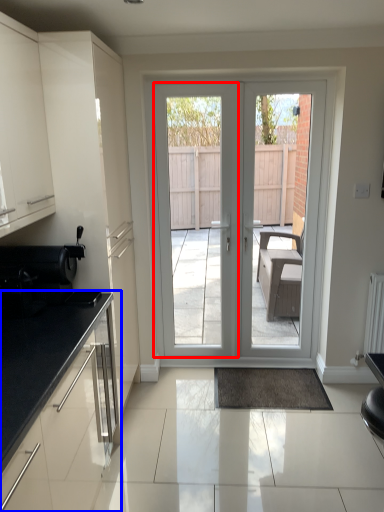
Question: Which object is further to the camera taking this photo, screen door (highlighted by a red box) or cabinetry (highlighted by a blue box)?

Choices:
 (A) screen door
 (B) cabinetry

Answer: (A)